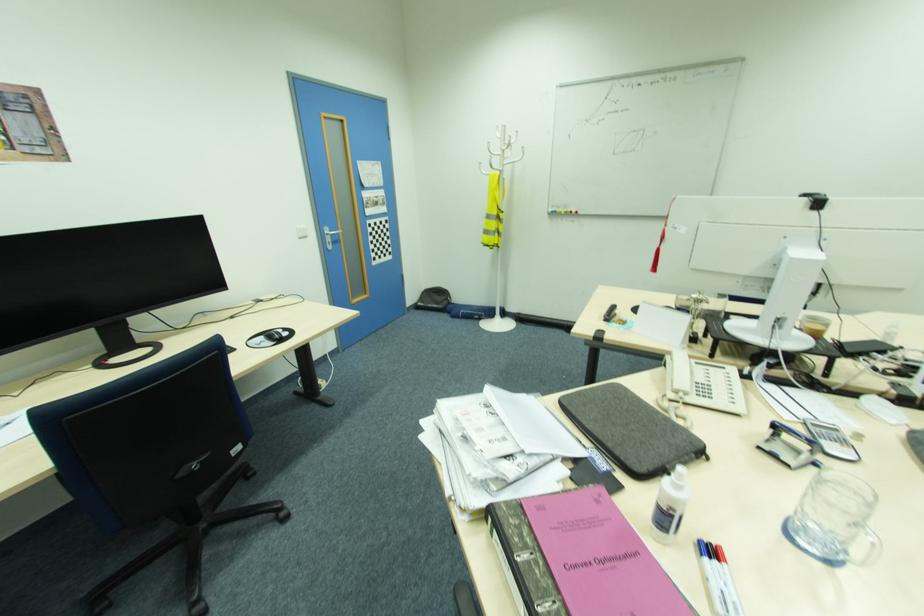
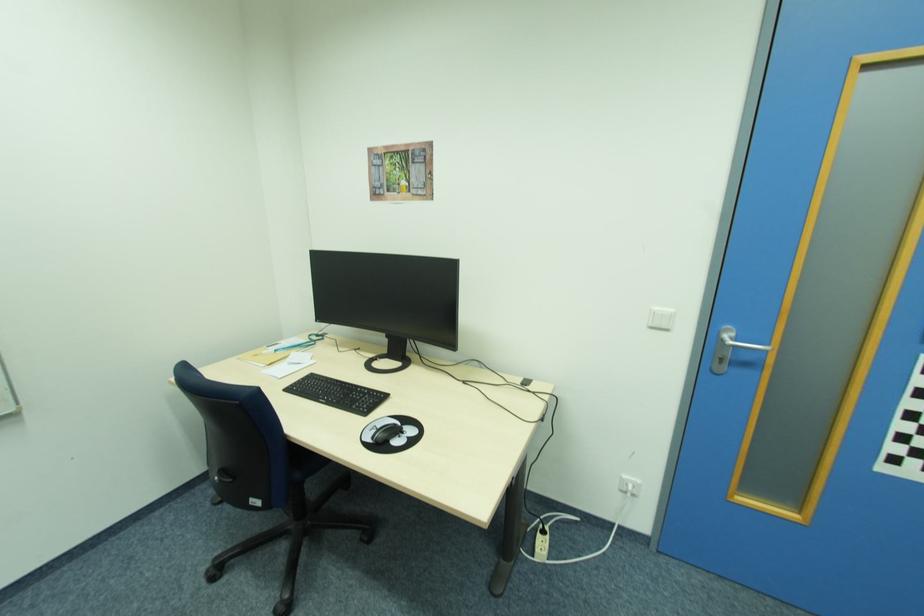
Locate, in the second image, the point that corresponds to the point at 310,237 in the first image.

(670, 329)